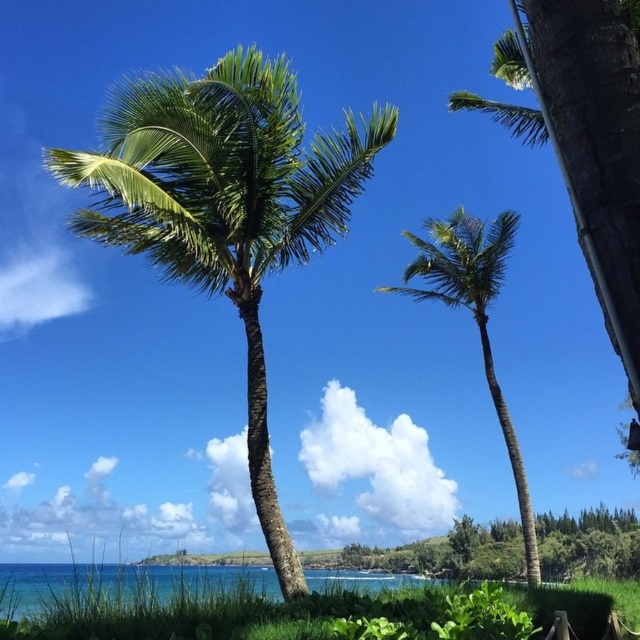
Question: Can you confirm if clear blue water at lower left is bigger than green leafy palm tree at center?

Choices:
 (A) yes
 (B) no

Answer: (A)

Question: Which of the following is the farthest from the observer?

Choices:
 (A) (83, 573)
 (B) (227, 90)
 (C) (490, 244)

Answer: (C)

Question: From the image, what is the correct spatial relationship of clear blue water at lower left in relation to green leafy palm tree at center?

Choices:
 (A) above
 (B) below

Answer: (B)

Question: Among these objects, which one is nearest to the camera?

Choices:
 (A) clear blue water at lower left
 (B) green leafy coconut tree at center
 (C) green leafy palm tree at center

Answer: (A)

Question: Which object is closer to the camera taking this photo?

Choices:
 (A) green leafy palm tree at center
 (B) green leafy coconut tree at center

Answer: (B)

Question: Is green leafy coconut tree at center behind green leafy palm tree at center?

Choices:
 (A) no
 (B) yes

Answer: (A)